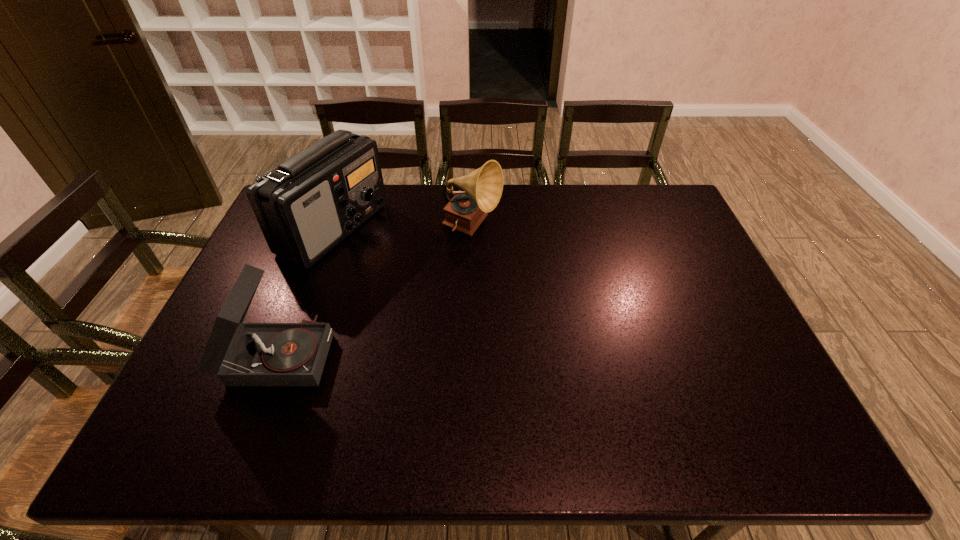
This screenshot has width=960, height=540. I want to click on radio receiver, so [x=307, y=205].

Locate an element on the screen. Image resolution: width=960 pixels, height=540 pixels. the farther phonograph_record is located at coordinates (483, 187).

Where is `the rightmost object`? Image resolution: width=960 pixels, height=540 pixels. the rightmost object is located at coordinates (483, 187).

Locate an element on the screen. This screenshot has width=960, height=540. the left phonograph_record is located at coordinates (241, 354).

The width and height of the screenshot is (960, 540). Identify the location of the nearer phonograph_record. (241, 354).

You are a GUI agent. You are given a task and a screenshot of the screen. Output one action in this format:
    pyautogui.click(x=<x>, y=<y>)
    Task: Click on the free spot located 0.270m on the front panel of the radio receiver
    The width and height of the screenshot is (960, 540).
    Given the screenshot: What is the action you would take?
    pyautogui.click(x=463, y=229)

Where is `vacant region located on the horn of the rightmost object`? vacant region located on the horn of the rightmost object is located at coordinates (556, 228).

Locate an element on the screen. This screenshot has width=960, height=540. free space located on the front-facing side of the left phonograph_record is located at coordinates (464, 353).

Image resolution: width=960 pixels, height=540 pixels. What are the coordinates of `radio receiver present at the far edge` in the screenshot? It's located at (307, 205).

This screenshot has height=540, width=960. Find the location of `phonograph record that is at the far edge`. phonograph record that is at the far edge is located at coordinates (483, 187).